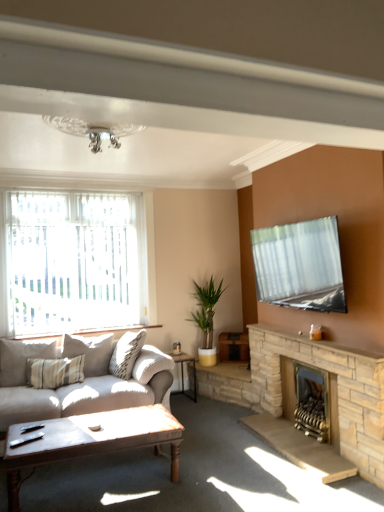
What do you see at coordinates (288, 387) in the screenshot?
I see `brick fireplace at lower right, which is counted as the 2th fireplace, starting from the front` at bounding box center [288, 387].

Image resolution: width=384 pixels, height=512 pixels. Describe the element at coordinates (337, 389) in the screenshot. I see `stone fireplace at right, the 2th fireplace in the back-to-front sequence` at that location.

What is the approximate width of stone fireplace at right?

It is 6.35 inches.

Describe the element at coordinates (306, 348) in the screenshot. Image resolution: width=384 pixels, height=512 pixels. I see `stone fireplace at right` at that location.

The image size is (384, 512). Find the location of `wooden side table at center`. wooden side table at center is located at coordinates (183, 374).

Which object is positioned more to the left, stone fireplace at right or light beige fabric pillow at left?

From the viewer's perspective, light beige fabric pillow at left appears more on the left side.

Is stone fireplace at right oriented towards light beige fabric pillow at left?

No, stone fireplace at right does not turn towards light beige fabric pillow at left.

Is point (324, 359) farther from camera compared to point (10, 373)?

No, it is in front of (10, 373).

Considering the sizes of objects stone fireplace at right and light beige fabric pillow at left in the image provided, who is shorter, stone fireplace at right or light beige fabric pillow at left?

Standing shorter between the two is stone fireplace at right.

Consider the image. Between stone fireplace at right, which is the 1th fireplace in front-to-back order, and translucent fabric window at left, which one has larger width?

With larger width is stone fireplace at right, which is the 1th fireplace in front-to-back order.

Considering the relative positions of stone fireplace at right, which is the 1th fireplace in front-to-back order, and translucent fabric window at left in the image provided, is stone fireplace at right, which is the 1th fireplace in front-to-back order, to the left of translucent fabric window at left from the viewer's perspective?

Incorrect, stone fireplace at right, which is the 1th fireplace in front-to-back order, is not on the left side of translucent fabric window at left.

Is stone fireplace at right, the 2th fireplace in the back-to-front sequence, positioned beyond the bounds of translucent fabric window at left?

Indeed, stone fireplace at right, the 2th fireplace in the back-to-front sequence, is completely outside translucent fabric window at left.

Is light beige fabric pillow at left at the back of wooden polished coffee table at lower center?

No, wooden polished coffee table at lower center is not facing the opposite direction of light beige fabric pillow at left.

Can you confirm if wooden polished coffee table at lower center is shorter than light beige fabric pillow at left?

Result: Correct, wooden polished coffee table at lower center is not as tall as light beige fabric pillow at left.

Does wooden polished coffee table at lower center appear on the left side of light beige fabric pillow at left?

No.

Who is smaller, green leafy plant at center or brick fireplace at lower right, the 1th fireplace in the back-to-front sequence?

With smaller size is brick fireplace at lower right, the 1th fireplace in the back-to-front sequence.

Is green leafy plant at center not inside brick fireplace at lower right, which is counted as the 2th fireplace, starting from the front?

green leafy plant at center lies outside brick fireplace at lower right, which is counted as the 2th fireplace, starting from the front,'s area.

Considering the sizes of objects green leafy plant at center and brick fireplace at lower right, the 1th fireplace in the back-to-front sequence, in the image provided, who is taller, green leafy plant at center or brick fireplace at lower right, the 1th fireplace in the back-to-front sequence,?

Standing taller between the two is green leafy plant at center.

Considering the positions of objects brick fireplace at lower right, the 1th fireplace in the back-to-front sequence, and stone fireplace at right in the image provided, who is more to the left, brick fireplace at lower right, the 1th fireplace in the back-to-front sequence, or stone fireplace at right?

stone fireplace at right.

Considering the relative sizes of brick fireplace at lower right, which is counted as the 2th fireplace, starting from the front, and stone fireplace at right in the image provided, is brick fireplace at lower right, which is counted as the 2th fireplace, starting from the front, smaller than stone fireplace at right?

No, brick fireplace at lower right, which is counted as the 2th fireplace, starting from the front, is not smaller than stone fireplace at right.

Image resolution: width=384 pixels, height=512 pixels. I want to click on mantle in front of the brick fireplace at lower right, which is counted as the 2th fireplace, starting from the front, so click(x=306, y=348).

Is brick fireplace at lower right, the 1th fireplace in the back-to-front sequence, wider than stone fireplace at right?

Yes, brick fireplace at lower right, the 1th fireplace in the back-to-front sequence, is wider than stone fireplace at right.

Considering the relative sizes of stone fireplace at right, the 2th fireplace in the back-to-front sequence, and wooden polished coffee table at lower center in the image provided, is stone fireplace at right, the 2th fireplace in the back-to-front sequence, thinner than wooden polished coffee table at lower center?

Yes, stone fireplace at right, the 2th fireplace in the back-to-front sequence, is thinner than wooden polished coffee table at lower center.

From a real-world perspective, which is physically below, stone fireplace at right, the 2th fireplace in the back-to-front sequence, or wooden polished coffee table at lower center?

From a 3D spatial view, wooden polished coffee table at lower center is below.

Is wooden polished coffee table at lower center at the back of stone fireplace at right, the 2th fireplace in the back-to-front sequence?

No, stone fireplace at right, the 2th fireplace in the back-to-front sequence, is not facing the opposite direction of wooden polished coffee table at lower center.

This screenshot has height=512, width=384. I want to click on the 2nd fireplace in front when counting from the translucent fabric window at left, so click(337, 389).

Considering the relative positions of translucent fabric window at left and stone fireplace at right, which is the 1th fireplace in front-to-back order, in the image provided, is translucent fabric window at left behind stone fireplace at right, which is the 1th fireplace in front-to-back order,?

Yes, it is.

Which of these two, translucent fabric window at left or stone fireplace at right, the 2th fireplace in the back-to-front sequence, is wider?

With larger width is stone fireplace at right, the 2th fireplace in the back-to-front sequence.

At what (x,y) coordinates should I click in order to perform the action: click on mantle above the light beige fabric pillow at left (from the image's perspective). Please return your answer as a coordinate pair (x, y). The height and width of the screenshot is (512, 384). Looking at the image, I should click on (306, 348).

From the translucent fabric window at left, count 1st fireplace to the right and point to it. Please provide its 2D coordinates.

[(337, 389)]

When comparing their distances from stone fireplace at right, which is the 1th fireplace in front-to-back order, does stone fireplace at right or wooden polished coffee table at lower center seem further?

Among the two, wooden polished coffee table at lower center is located further to stone fireplace at right, which is the 1th fireplace in front-to-back order.

Looking at the image, which one is located closer to green leafy plant at center, translucent fabric window at left or stone fireplace at right?

stone fireplace at right is closer to green leafy plant at center.

Considering their positions, is translucent fabric window at left positioned further to wooden side table at center than light beige fabric pillow at left?

Among the two, translucent fabric window at left is located further to wooden side table at center.

Looking at the image, which one is located closer to stone fireplace at right, light beige fabric pillow at left or stone fireplace at right, which is the 1th fireplace in front-to-back order?

Among the two, stone fireplace at right, which is the 1th fireplace in front-to-back order, is located nearer to stone fireplace at right.

Based on their spatial positions, is stone fireplace at right, which is the 1th fireplace in front-to-back order, or light beige fabric pillow at left closer to green leafy plant at center?

stone fireplace at right, which is the 1th fireplace in front-to-back order.

Which object lies nearer to the anchor point wooden polished coffee table at lower center, green leafy plant at center or stone fireplace at right?

stone fireplace at right is closer to wooden polished coffee table at lower center.

Based on their spatial positions, is translucent fabric window at left or light beige fabric pillow at left further from stone fireplace at right, which is the 1th fireplace in front-to-back order?

light beige fabric pillow at left.

Estimate the real-world distances between objects in this image. Which object is further from translucent fabric window at left, stone fireplace at right, the 2th fireplace in the back-to-front sequence, or wooden side table at center?

Based on the image, stone fireplace at right, the 2th fireplace in the back-to-front sequence, appears to be further to translucent fabric window at left.

Where is `mantle located between wooden polished coffee table at lower center and brick fireplace at lower right, the 1th fireplace in the back-to-front sequence, in the left-right direction`? This screenshot has width=384, height=512. mantle located between wooden polished coffee table at lower center and brick fireplace at lower right, the 1th fireplace in the back-to-front sequence, in the left-right direction is located at coordinates (306, 348).

The image size is (384, 512). I want to click on window located between light beige fabric pillow at left and brick fireplace at lower right, which is counted as the 2th fireplace, starting from the front, in the left-right direction, so click(75, 261).

Locate an element on the screen. table located between light beige fabric pillow at left and green leafy plant at center in the left-right direction is located at coordinates (183, 374).

This screenshot has width=384, height=512. I want to click on pillow located between wooden polished coffee table at lower center and wooden side table at center in the depth direction, so click(21, 359).